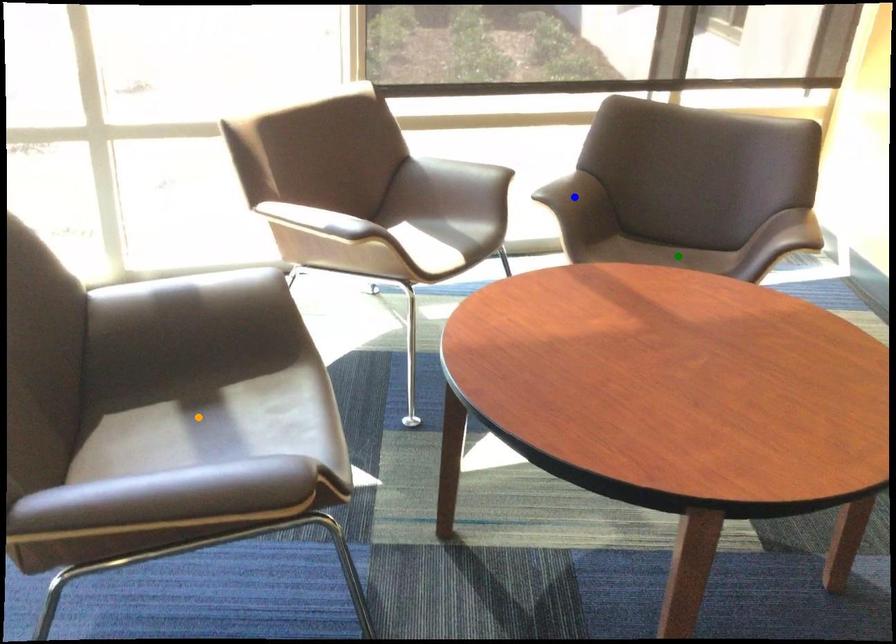
Order these from nearest to farthest:
- blue point
- green point
- orange point

green point, blue point, orange point